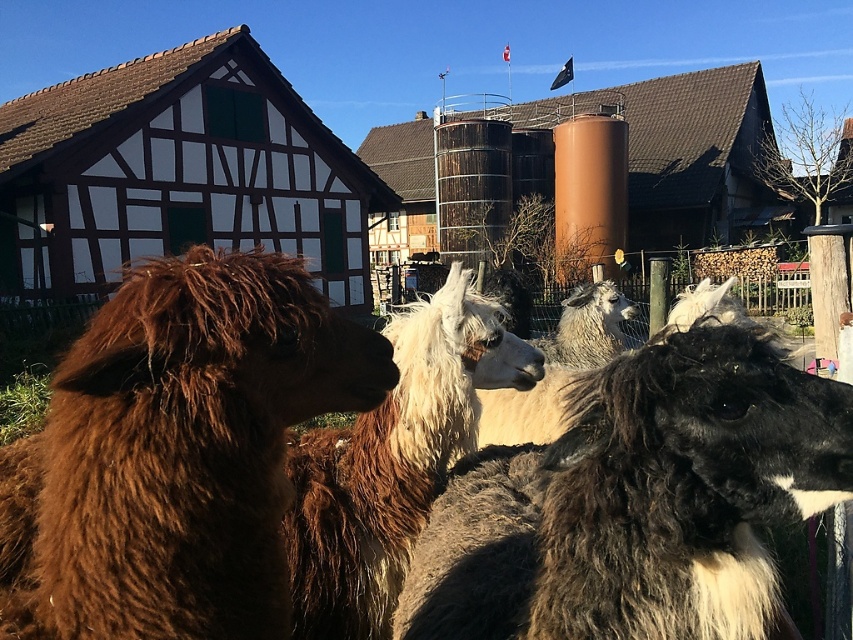
You are standing in the rural scene and want to walk from the brown woolen camel at lower left to the brown fluffy alpaca at left. Which direction should you move to reach the alpaca?

The brown woolen camel at lower left is positioned over the brown fluffy alpaca at left, so you should move downward to reach the alpaca.

From the picture: You are a photographer trying to capture both the brown woolen camel at lower left and the white woolly alpaca at center in a single frame. Given their sizes, which animal would require you to zoom in more to include its entire body in the photo?

The brown woolen camel at lower left occupies less space than the white woolly alpaca at center, so you would need to zoom in more to capture the white woolly alpaca at center since it takes up more space in the frame.